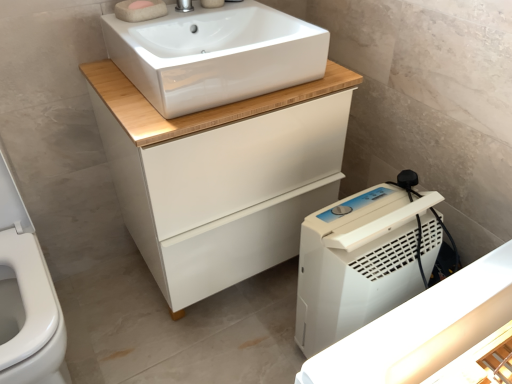
Question: Does white plastic dehumidifier at lower right have a lesser width compared to pink sponge at upper center?

Choices:
 (A) yes
 (B) no

Answer: (B)

Question: Is the depth of white plastic dehumidifier at lower right greater than that of pink sponge at upper center?

Choices:
 (A) no
 (B) yes

Answer: (A)

Question: Can you confirm if white plastic dehumidifier at lower right is taller than pink sponge at upper center?

Choices:
 (A) yes
 (B) no

Answer: (A)

Question: Does white plastic dehumidifier at lower right turn towards pink sponge at upper center?

Choices:
 (A) yes
 (B) no

Answer: (B)

Question: Is white plastic dehumidifier at lower right to the left of pink sponge at upper center from the viewer's perspective?

Choices:
 (A) no
 (B) yes

Answer: (A)

Question: Considering the relative positions of pink sponge at upper center and white matte cabinet at center in the image provided, is pink sponge at upper center to the left or to the right of white matte cabinet at center?

Choices:
 (A) left
 (B) right

Answer: (A)

Question: In terms of height, does pink sponge at upper center look taller or shorter compared to white matte cabinet at center?

Choices:
 (A) tall
 (B) short

Answer: (B)

Question: Is pink sponge at upper center inside or outside of white matte cabinet at center?

Choices:
 (A) outside
 (B) inside

Answer: (A)

Question: Considering their positions, is pink sponge at upper center located in front of or behind white matte cabinet at center?

Choices:
 (A) behind
 (B) front

Answer: (A)

Question: From a real-world perspective, is white matte cabinet at center positioned above or below pink sponge at upper center?

Choices:
 (A) above
 (B) below

Answer: (B)

Question: From their relative heights in the image, would you say white matte cabinet at center is taller or shorter than pink sponge at upper center?

Choices:
 (A) tall
 (B) short

Answer: (A)

Question: Choose the correct answer: Is white matte cabinet at center inside pink sponge at upper center or outside it?

Choices:
 (A) inside
 (B) outside

Answer: (B)

Question: From the image's perspective, relative to pink sponge at upper center, is white matte cabinet at center above or below?

Choices:
 (A) below
 (B) above

Answer: (A)

Question: Is white matte cabinet at center inside the boundaries of silver metallic tap at upper center, or outside?

Choices:
 (A) outside
 (B) inside

Answer: (A)

Question: Considering the positions of white matte cabinet at center and silver metallic tap at upper center in the image, is white matte cabinet at center wider or thinner than silver metallic tap at upper center?

Choices:
 (A) wide
 (B) thin

Answer: (A)